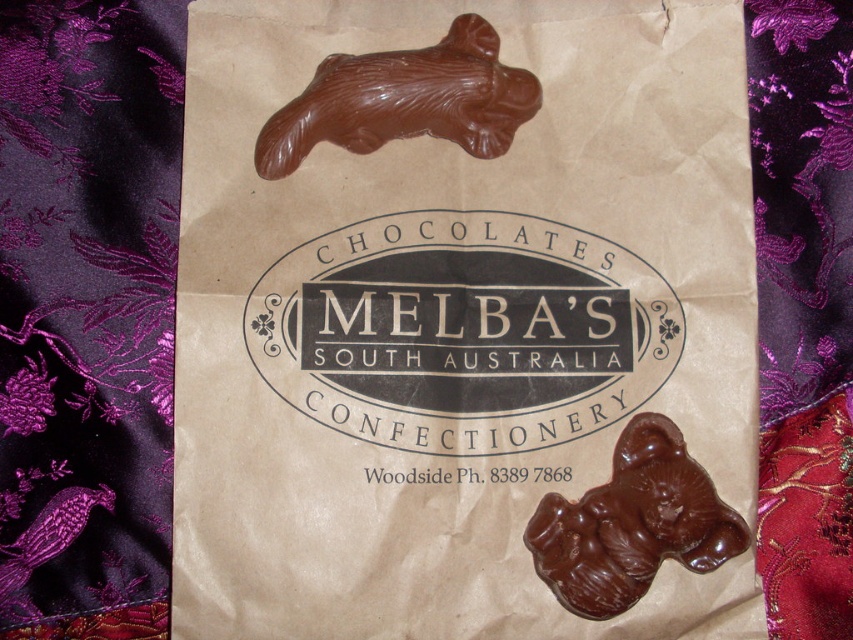
Who is positioned more to the right, brown paper bag at center or chocolatesmoothbear at upper center?

Positioned to the right is brown paper bag at center.

Who is lower down, brown paper bag at center or chocolatesmoothbear at upper center?

brown paper bag at center is below.

Between point (675, 524) and point (361, 122), which one is positioned behind?

The point (361, 122) is more distant.

Where is `brown paper bag at center`? The width and height of the screenshot is (853, 640). brown paper bag at center is located at coordinates (465, 323).

At what (x,y) coordinates should I click in order to perform the action: click on purple brocade quilt at left. Please return your answer as a coordinate pair (x, y). Looking at the image, I should click on (86, 312).

Does point (35, 582) come behind point (842, 268)?

No, it is in front of (842, 268).

Is point (151, 429) closer to viewer compared to point (811, 406)?

Yes, point (151, 429) is closer to viewer.

At what (x,y) coordinates should I click in order to perform the action: click on purple brocade quilt at left. Please return your answer as a coordinate pair (x, y). Image resolution: width=853 pixels, height=640 pixels. Looking at the image, I should click on (86, 312).

Based on the photo, does purple brocade quilt at lower right have a smaller size compared to chocolatesmoothbear at upper center?

Actually, purple brocade quilt at lower right might be larger than chocolatesmoothbear at upper center.

Between purple brocade quilt at lower right and chocolatesmoothbear at upper center, which one appears on the left side from the viewer's perspective?

chocolatesmoothbear at upper center

Is point (840, 118) behind point (486, 52)?

Yes, point (840, 118) is farther from viewer.

This screenshot has width=853, height=640. Find the location of `purple brocade quilt at lower right`. purple brocade quilt at lower right is located at coordinates (804, 308).